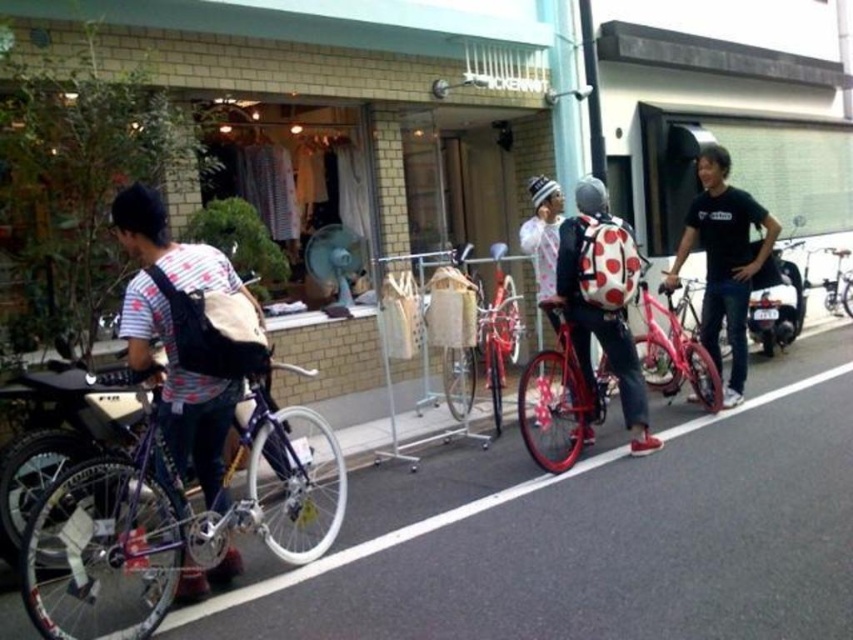
You are standing in the shopping area and want to locate two specific points marked in the image. Which point, point (578, 237) or point (592, 193), is nearer to you?

Point (578, 237) is closer to the viewer than point (592, 193).

You are a delivery person who needs to secure a package between the polka dot backpack at center and the gray fabric helmet at center. Given that the package is 15 inches long, will it fit between them?

The polka dot backpack at center is 15.11 inches from the gray fabric helmet at center. Since the package is 15 inches long, it will fit between them with a small amount of space remaining.